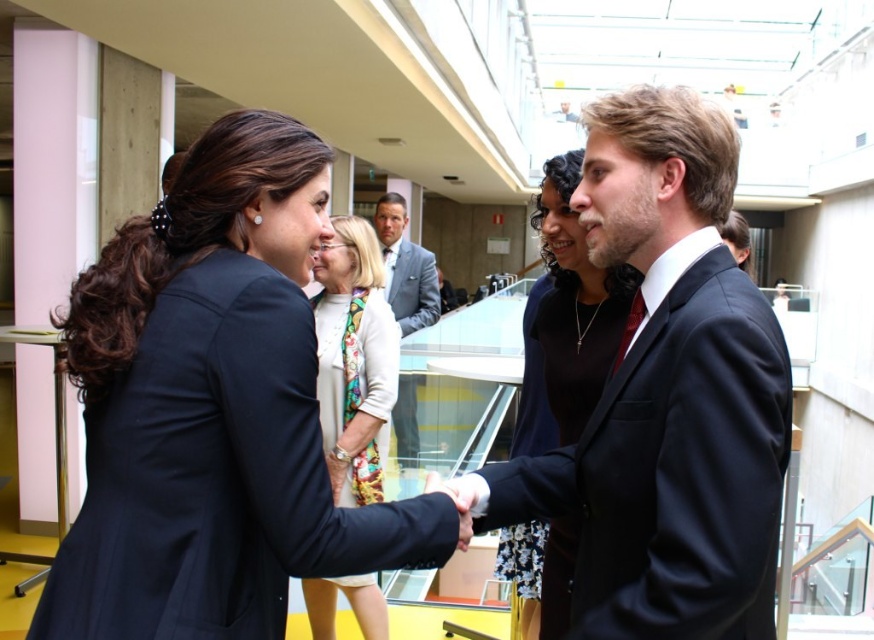
Does matte black suit at center have a lesser width compared to white silk scarf at center?

No, matte black suit at center is not thinner than white silk scarf at center.

Can you confirm if matte black suit at center is positioned below white silk scarf at center?

Actually, matte black suit at center is above white silk scarf at center.

Does point (153, 410) lie behind point (368, 368)?

No.

Identify the location of matte black suit at center. (213, 410).

Consider the image. Between shiny black suit at center and light gray suit at center, which one appears on the left side from the viewer's perspective?

light gray suit at center

Image resolution: width=874 pixels, height=640 pixels. I want to click on shiny black suit at center, so point(666,396).

Which is in front, point (157, 573) or point (410, 428)?

Point (157, 573) is in front.

In the scene shown: Who is lower down, matte black suit at center or light gray suit at center?

matte black suit at center is below.

Between point (91, 272) and point (438, 308), which one is positioned behind?

The point (438, 308) is more distant.

Locate an element on the screen. matte black suit at center is located at coordinates (213, 410).